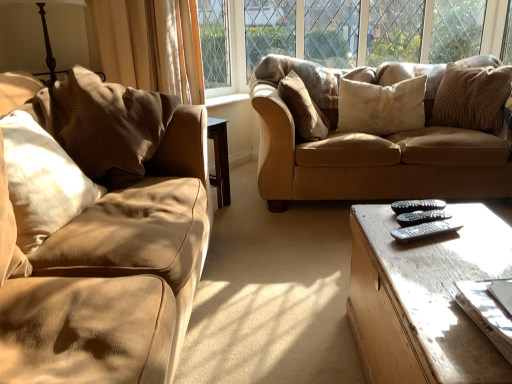
In order to click on free space in front of black plastic remote at center, which is counted as the 3th remote, starting from the back in this screenshot , I will do `click(444, 256)`.